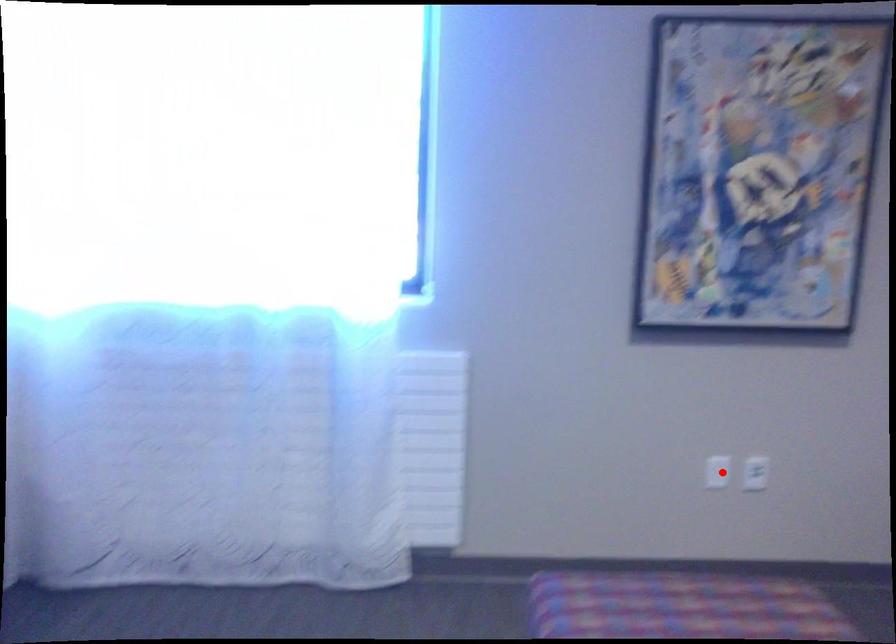
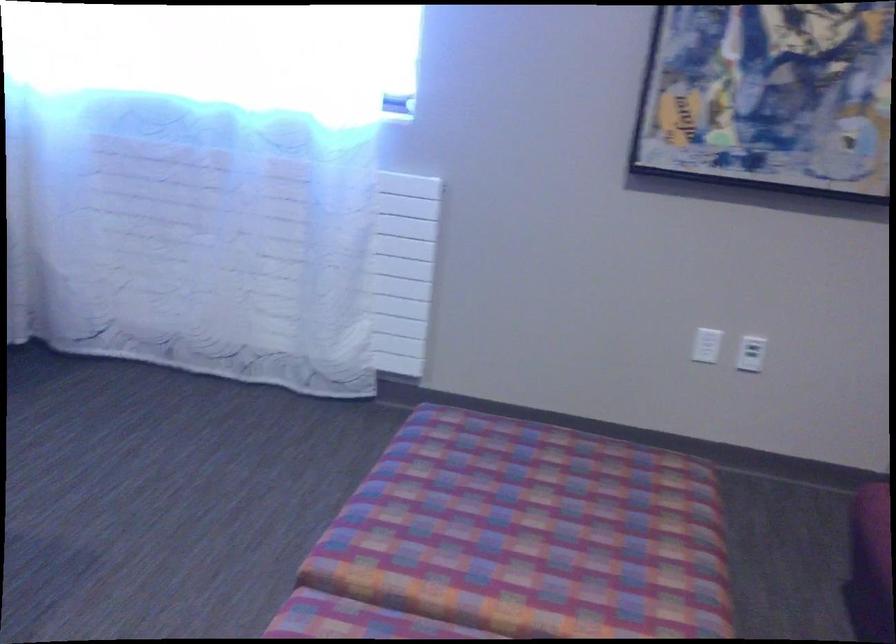
The point at the highlighted location is marked in the first image. Where is the corresponding point in the second image?

(707, 345)